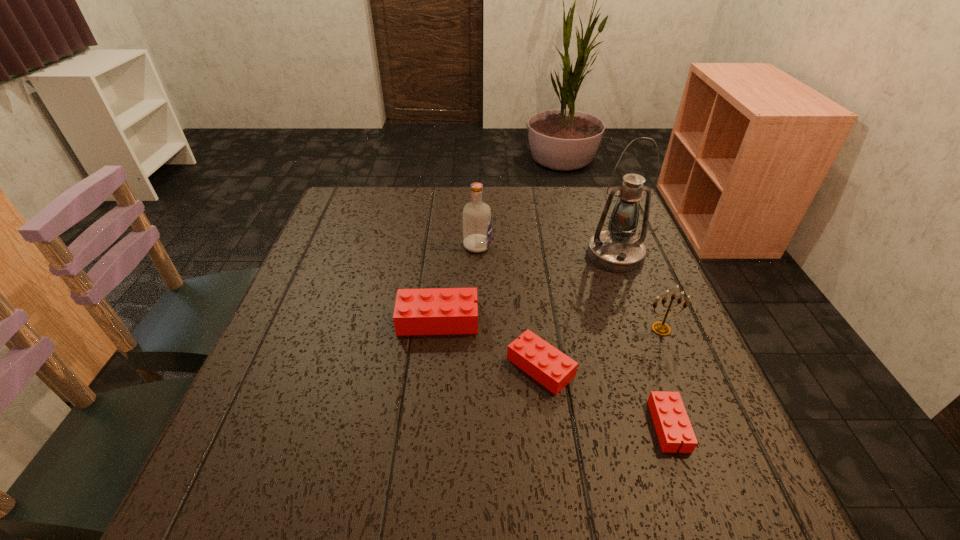
The height and width of the screenshot is (540, 960). What are the coordinates of `free location that satisfies the following two spatial constraints: 1. on the label of the oil lamp; 2. on the right side of the vodka` in the screenshot? It's located at (477, 254).

Find the location of a particular element. free location that satisfies the following two spatial constraints: 1. on the label of the second tallest object; 2. on the left side of the candelabrum is located at coordinates (476, 329).

Find the location of `blank area in the image that satisfies the following two spatial constraints: 1. on the back side of the fourth tallest object; 2. on the left side of the oil lamp`. blank area in the image that satisfies the following two spatial constraints: 1. on the back side of the fourth tallest object; 2. on the left side of the oil lamp is located at coordinates (444, 254).

Find the location of a particular element. This screenshot has width=960, height=540. free space that satisfies the following two spatial constraints: 1. on the back side of the shortest object; 2. on the label of the vodka is located at coordinates (605, 246).

The image size is (960, 540). What are the coordinates of `vacant area that satisfies the following two spatial constraints: 1. on the back side of the tallest object; 2. on the right side of the second Lego from right to left` in the screenshot? It's located at (526, 254).

Find the location of a particular element. Image resolution: width=960 pixels, height=540 pixels. blank area in the image that satisfies the following two spatial constraints: 1. on the label of the second tallest object; 2. on the left side of the tallest object is located at coordinates (477, 254).

Locate an element on the screen. Image resolution: width=960 pixels, height=540 pixels. vacant region that satisfies the following two spatial constraints: 1. on the label of the tallest object; 2. on the left side of the fifth shortest object is located at coordinates (477, 254).

Where is `vacant space that satisfies the following two spatial constraints: 1. on the label of the second nearest Lego; 2. on the left side of the vodka`? This screenshot has width=960, height=540. vacant space that satisfies the following two spatial constraints: 1. on the label of the second nearest Lego; 2. on the left side of the vodka is located at coordinates (476, 367).